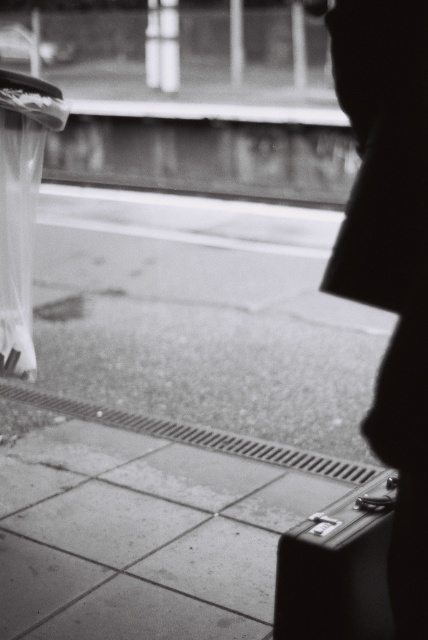
This screenshot has height=640, width=428. What do you see at coordinates (338, 568) in the screenshot?
I see `metallic suitcase at lower right` at bounding box center [338, 568].

Between metallic suitcase at lower right and transparent nylon umbrella at left, which one has more height?

With more height is transparent nylon umbrella at left.

Between point (357, 548) and point (23, 120), which one is positioned in front?

Positioned in front is point (357, 548).

Find the location of a particular element. This screenshot has height=640, width=428. metallic suitcase at lower right is located at coordinates (338, 568).